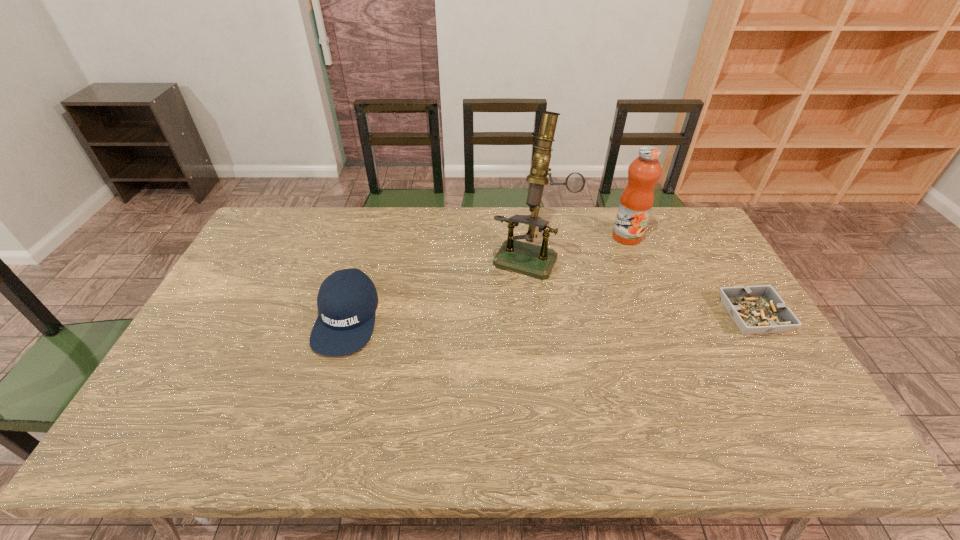
I want to click on vacant area that lies between the baseball cap and the tallest object, so (439, 287).

Where is `free space between the second shortest object and the microscope`? This screenshot has width=960, height=540. free space between the second shortest object and the microscope is located at coordinates (439, 287).

Locate an element on the screen. unoccupied position between the shortest object and the second object from right to left is located at coordinates (690, 276).

The height and width of the screenshot is (540, 960). What are the coordinates of `free space between the tallest object and the ashtray` in the screenshot? It's located at (641, 286).

At what (x,y) coordinates should I click in order to perform the action: click on unoccupied area between the tallest object and the second shortest object. Please return your answer as a coordinate pair (x, y). Looking at the image, I should click on (439, 287).

Choose which object is the second nearest neighbor to the microscope. Please provide its 2D coordinates. Your answer should be formatted as a tuple, i.e. [(x, y)], where the tuple contains the x and y coordinates of a point satisfying the conditions above.

[(347, 300)]

What are the coordinates of `the closest object relative to the third object from left to right` in the screenshot? It's located at (538, 261).